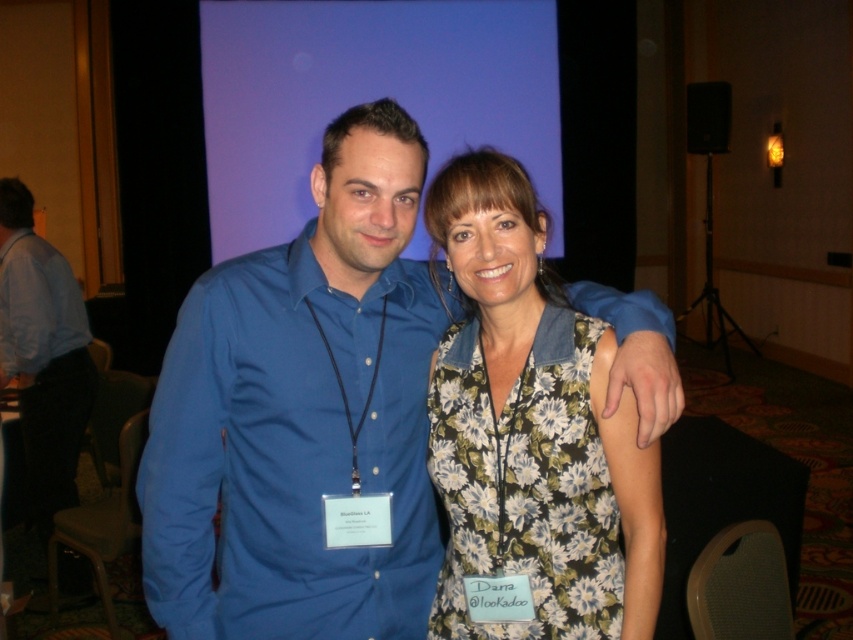
Question: Which object is closer to the camera taking this photo?

Choices:
 (A) matte blue shirt at center
 (B) blue smooth shirt at center

Answer: (B)

Question: Can you confirm if blue shirt at left is thinner than light blue cotton shirt at left?

Choices:
 (A) yes
 (B) no

Answer: (B)

Question: Is matte blue shirt at center closer to the viewer compared to floral fabric dress at center?

Choices:
 (A) yes
 (B) no

Answer: (A)

Question: Which of the following is the farthest from the observer?

Choices:
 (A) (473, 484)
 (B) (265, 250)
 (C) (42, 317)
 (D) (91, 388)

Answer: (D)

Question: Which of the following is the farthest from the observer?

Choices:
 (A) light blue cotton shirt at left
 (B) floral fabric dress at center

Answer: (A)

Question: Is blue shirt at left above light blue cotton shirt at left?

Choices:
 (A) no
 (B) yes

Answer: (A)